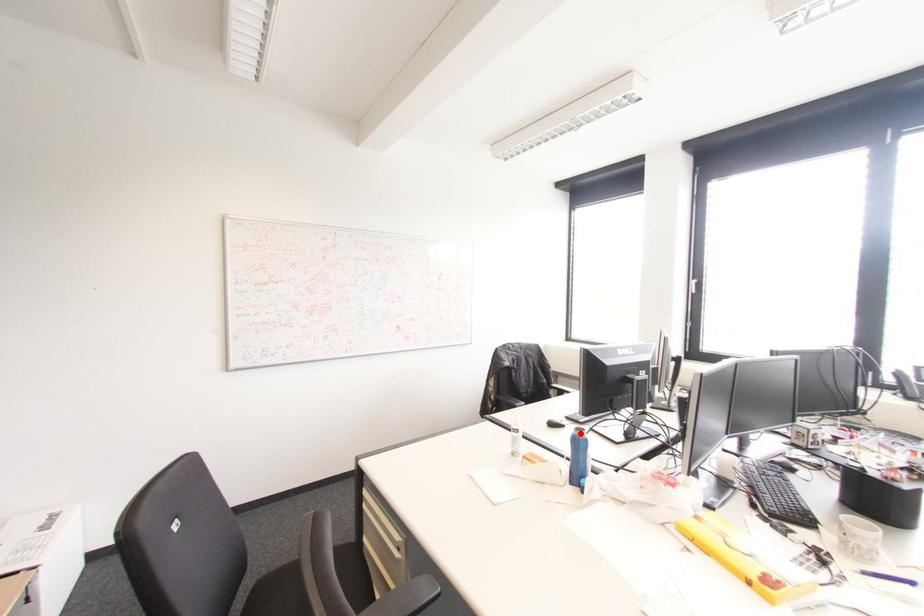
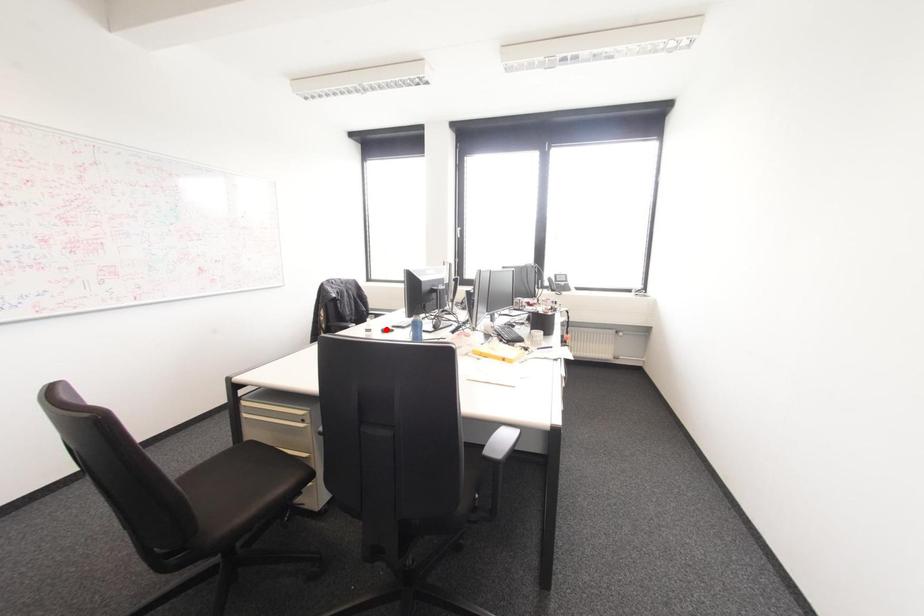
I am providing you with two images of the same scene from different viewpoints. A red point is marked on the first image and another point is marked on the second image. Is the marked point in image1 the same physical position as the marked point in image2?

No